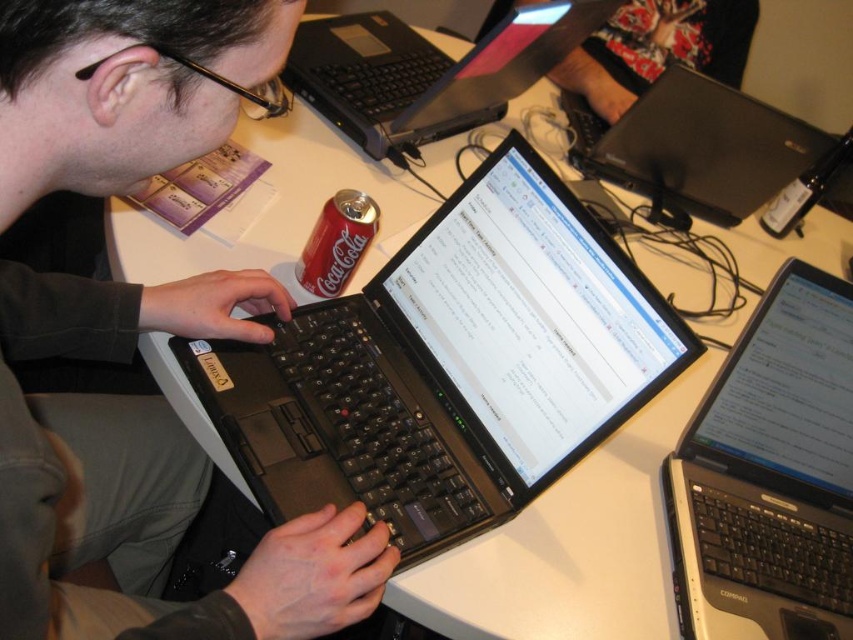
Question: Which point appears closest to the camera in this image?

Choices:
 (A) (729, 129)
 (B) (337, 52)
 (C) (164, 16)
 (D) (750, 32)

Answer: (C)

Question: Which point appears closest to the camera in this image?

Choices:
 (A) (268, 330)
 (B) (346, 19)
 (C) (363, 236)
 (D) (756, 115)

Answer: (A)

Question: Can you confirm if black matte laptop at upper center is positioned to the left of floral fabric skirt at upper center?

Choices:
 (A) yes
 (B) no

Answer: (A)

Question: Is black plastic laptop at center to the left of red matte coca-cola can at center from the viewer's perspective?

Choices:
 (A) yes
 (B) no

Answer: (B)

Question: Which point is closer to the camera taking this photo?

Choices:
 (A) (209, 58)
 (B) (337, 250)
 (C) (672, 467)
 (D) (668, 13)

Answer: (A)

Question: Is black glossy laptop at upper right above floral fabric skirt at upper center?

Choices:
 (A) yes
 (B) no

Answer: (B)